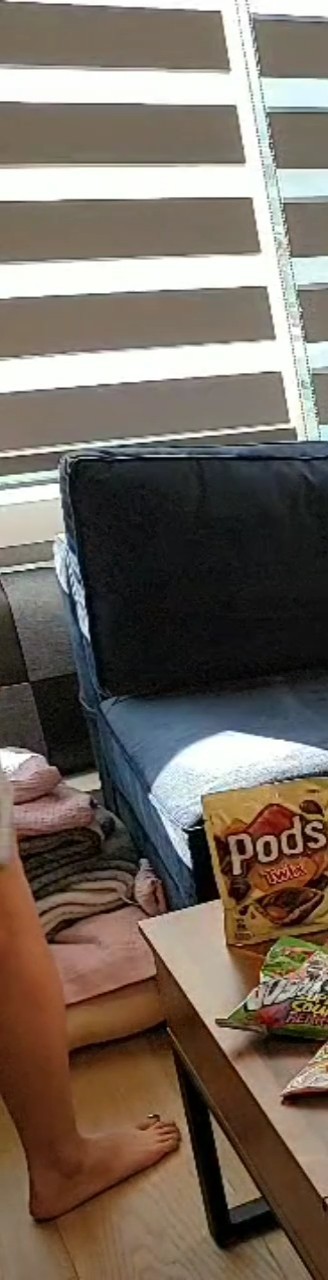
You are a GUI agent. You are given a task and a screenshot of the screen. Output one action in this format:
    pyautogui.click(x=<x>, y=<y>)
    Task: Click on the window divider
    
    Given the screenshot: What is the action you would take?
    pyautogui.click(x=265, y=150)